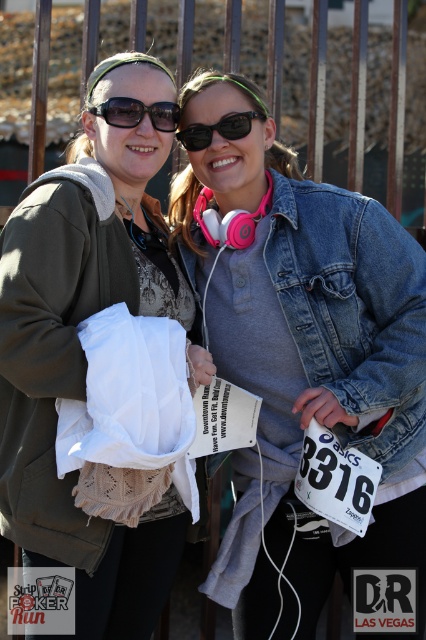
Question: Among these points, which one is farthest from the camera?

Choices:
 (A) (362, 344)
 (B) (316, 177)
 (C) (164, 112)

Answer: (B)

Question: Which point is closer to the camera?

Choices:
 (A) (152, 120)
 (B) (37, 234)
 (C) (319, 161)
 (D) (238, 608)

Answer: (B)

Question: Where is matte green jacket at left located in relation to matte black sunglasses at upper center in the image?

Choices:
 (A) above
 (B) below

Answer: (B)

Question: Does matte green jacket at left appear on the left side of matte black sunglasses at upper center?

Choices:
 (A) no
 (B) yes

Answer: (B)

Question: Is denim jacket at center wider than matte green jacket at left?

Choices:
 (A) no
 (B) yes

Answer: (B)

Question: Among these objects, which one is nearest to the camera?

Choices:
 (A) matte black sunglasses at upper center
 (B) denim jacket at center
 (C) matte green jacket at left

Answer: (C)